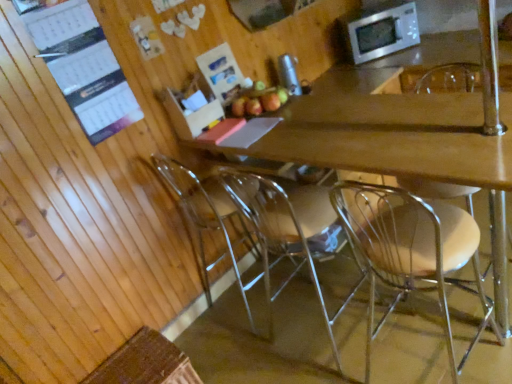
Question: Does clear plastic chair at lower center, which appears as the first chair when viewed from the left, have a lesser height compared to white paper calendar at upper left?

Choices:
 (A) yes
 (B) no

Answer: (B)

Question: Considering the relative sizes of clear plastic chair at lower center, the 4th chair when ordered from right to left, and white paper calendar at upper left in the image provided, is clear plastic chair at lower center, the 4th chair when ordered from right to left, taller than white paper calendar at upper left?

Choices:
 (A) no
 (B) yes

Answer: (B)

Question: Is clear plastic chair at lower center, which appears as the first chair when viewed from the left, wider than white paper calendar at upper left?

Choices:
 (A) yes
 (B) no

Answer: (A)

Question: Is the position of clear plastic chair at lower center, which appears as the first chair when viewed from the left, less distant than that of white paper calendar at upper left?

Choices:
 (A) no
 (B) yes

Answer: (A)

Question: Is white paper calendar at upper left inside clear plastic chair at lower center, the 4th chair when ordered from right to left?

Choices:
 (A) no
 (B) yes

Answer: (A)

Question: From a real-world perspective, is clear plastic chair at lower center, which appears as the first chair when viewed from the left, physically below white paper calendar at upper left?

Choices:
 (A) yes
 (B) no

Answer: (A)

Question: Does clear plastic chair at lower center, the 4th chair when ordered from right to left, have a greater width compared to red matte apple at center?

Choices:
 (A) no
 (B) yes

Answer: (B)

Question: Does clear plastic chair at lower center, the 4th chair when ordered from right to left, have a larger size compared to red matte apple at center?

Choices:
 (A) no
 (B) yes

Answer: (B)

Question: From the image's perspective, is clear plastic chair at lower center, the 4th chair when ordered from right to left, on top of red matte apple at center?

Choices:
 (A) yes
 (B) no

Answer: (B)

Question: Can you confirm if clear plastic chair at lower center, which appears as the first chair when viewed from the left, is smaller than red matte apple at center?

Choices:
 (A) no
 (B) yes

Answer: (A)

Question: Can you confirm if clear plastic chair at lower center, which appears as the first chair when viewed from the left, is shorter than red matte apple at center?

Choices:
 (A) no
 (B) yes

Answer: (A)

Question: Does clear plastic chair at lower center, the 4th chair when ordered from right to left, have a greater height compared to red matte apple at center?

Choices:
 (A) yes
 (B) no

Answer: (A)

Question: Can you confirm if clear plastic chair at lower center, the 4th chair when ordered from right to left, is taller than wooden desk at center?

Choices:
 (A) no
 (B) yes

Answer: (B)